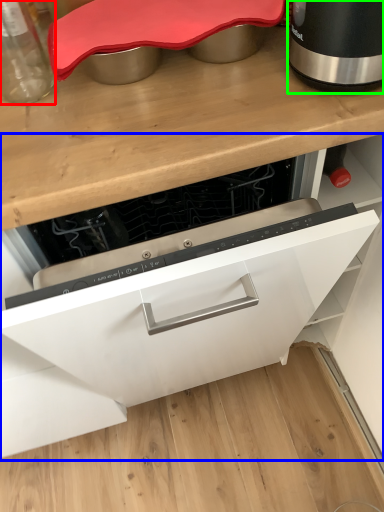
Question: Based on their relative distances, which object is nearer to kitchen appliance (highlighted by a red box)? Choose from cabinetry (highlighted by a blue box) and home appliance (highlighted by a green box).

Choices:
 (A) cabinetry
 (B) home appliance

Answer: (B)